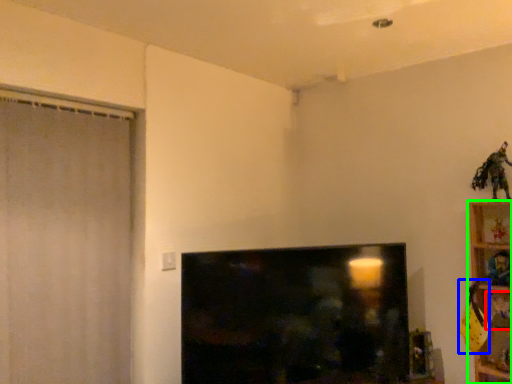
Question: Considering the real-world distances, which object is closest to toy (highlighted by a red box)? toy (highlighted by a blue box) or furniture (highlighted by a green box).

Choices:
 (A) toy
 (B) furniture

Answer: (A)